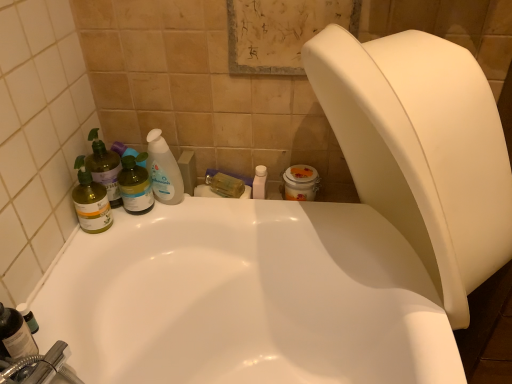
Question: Considering the relative sizes of translucent plastic bottle at upper left, marked as the first cleaning product in a right-to-left arrangement, and white glossy bottle at center, which is the second toiletry from front to back, in the image provided, is translucent plastic bottle at upper left, marked as the first cleaning product in a right-to-left arrangement, bigger than white glossy bottle at center, which is the second toiletry from front to back,?

Choices:
 (A) no
 (B) yes

Answer: (B)

Question: Is translucent plastic bottle at upper left, the third cleaning product positioned from the left, taller than white glossy bottle at center, the first toiletry positioned from the top?

Choices:
 (A) no
 (B) yes

Answer: (B)

Question: Is translucent plastic bottle at upper left, the third cleaning product positioned from the left, at the right side of white glossy bottle at center, the 1th toiletry when ordered from back to front?

Choices:
 (A) yes
 (B) no

Answer: (B)

Question: From a real-world perspective, is translucent plastic bottle at upper left, the third cleaning product positioned from the left, below white glossy bottle at center, the 2th toiletry in the bottom-to-top sequence?

Choices:
 (A) no
 (B) yes

Answer: (A)

Question: From the image's perspective, is translucent plastic bottle at upper left, the third cleaning product positioned from the left, located above white glossy bottle at center, which appears as the first toiletry when viewed from the right?

Choices:
 (A) yes
 (B) no

Answer: (A)

Question: From a real-world perspective, is translucent green spray bottle at left, the 2th cleaning product positioned from the right, physically located above or below translucent plastic bottle at lower left, which is the first toiletry from bottom to top?

Choices:
 (A) below
 (B) above

Answer: (B)

Question: Is translucent green spray bottle at left, placed as the 2th cleaning product when sorted from left to right, situated inside translucent plastic bottle at lower left, the 2th toiletry from the back, or outside?

Choices:
 (A) inside
 (B) outside

Answer: (B)

Question: Is translucent green spray bottle at left, placed as the 2th cleaning product when sorted from left to right, bigger or smaller than translucent plastic bottle at lower left, which is the second toiletry in top-to-bottom order?

Choices:
 (A) small
 (B) big

Answer: (B)

Question: Visually, is translucent green spray bottle at left, placed as the 2th cleaning product when sorted from left to right, positioned to the left or to the right of translucent plastic bottle at lower left, which is the first toiletry from bottom to top?

Choices:
 (A) right
 (B) left

Answer: (A)

Question: Considering the positions of point (84, 210) and point (484, 205), is point (84, 210) closer or farther from the camera than point (484, 205)?

Choices:
 (A) farther
 (B) closer

Answer: (A)

Question: In terms of size, does translucent green bottle at left, which is counted as the 3th cleaning product, starting from the right, appear bigger or smaller than white plastic bidet at upper right?

Choices:
 (A) small
 (B) big

Answer: (A)

Question: Looking at their shapes, would you say translucent green bottle at left, which is counted as the 3th cleaning product, starting from the right, is wider or thinner than white plastic bidet at upper right?

Choices:
 (A) wide
 (B) thin

Answer: (B)

Question: Would you say translucent green bottle at left, which ranks as the 1th cleaning product in left-to-right order, is inside or outside white plastic bidet at upper right?

Choices:
 (A) inside
 (B) outside

Answer: (B)

Question: Visually, is translucent green bottle at left, which ranks as the 1th cleaning product in left-to-right order, positioned to the left or to the right of translucent plastic bottle at left?

Choices:
 (A) left
 (B) right

Answer: (A)

Question: Is translucent green bottle at left, which ranks as the 1th cleaning product in left-to-right order, taller or shorter than translucent plastic bottle at left?

Choices:
 (A) short
 (B) tall

Answer: (A)